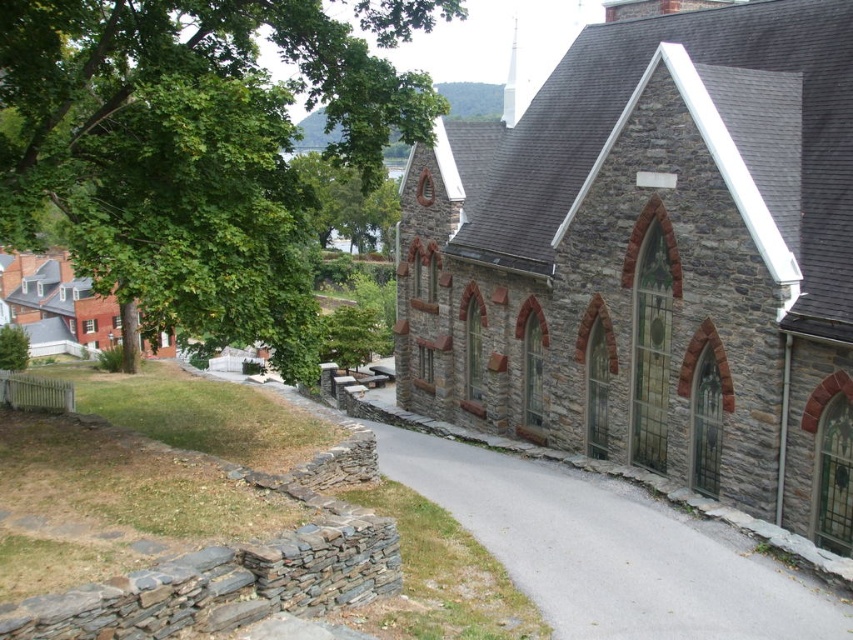
Can you confirm if stone church at center is shorter than green leafy tree at upper left?

Yes.

Is stone church at center above green leafy tree at upper left?

Incorrect, stone church at center is not positioned above green leafy tree at upper left.

Is point (737, 369) closer to viewer compared to point (90, 122)?

That is False.

You are a GUI agent. You are given a task and a screenshot of the screen. Output one action in this format:
    pyautogui.click(x=<x>, y=<y>)
    Task: Click on the stone church at center
    The image size is (853, 640).
    Given the screenshot: What is the action you would take?
    pyautogui.click(x=653, y=259)